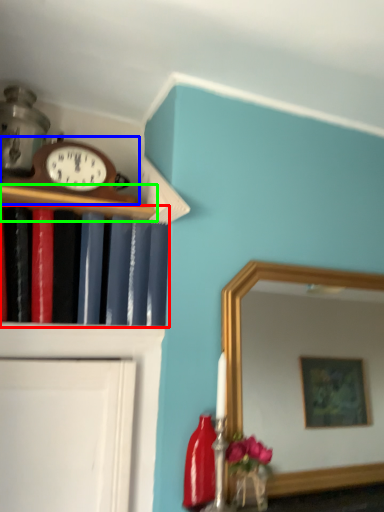
Question: Which is nearer to the book (highlighted by a red box)? wall clock (highlighted by a blue box) or shelf (highlighted by a green box).

Choices:
 (A) wall clock
 (B) shelf

Answer: (B)